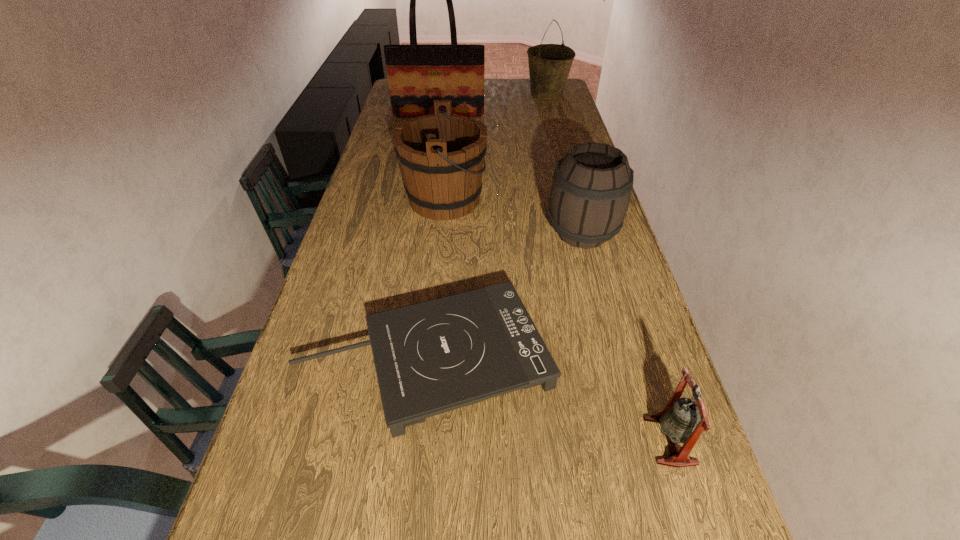
At what (x,y) coordinates should I click in order to perform the action: click on blank region between the leftmost wine bucket and the hotplate. Please return your answer as a coordinate pair (x, y). This screenshot has width=960, height=540. Looking at the image, I should click on (436, 279).

Image resolution: width=960 pixels, height=540 pixels. I want to click on free space between the farthest object and the hotplate, so click(x=487, y=226).

Find the location of a particular element. The height and width of the screenshot is (540, 960). empty space between the fifth tallest object and the tallest object is located at coordinates (554, 278).

The height and width of the screenshot is (540, 960). Find the location of `free spot between the leftmost wine bucket and the farthest wine bucket`. free spot between the leftmost wine bucket and the farthest wine bucket is located at coordinates (495, 146).

Find the location of a particular element. The width and height of the screenshot is (960, 540). object that is the third nearest to the hotplate is located at coordinates (441, 156).

This screenshot has height=540, width=960. What are the coordinates of `object that is the closest to the hotplate` in the screenshot? It's located at (589, 198).

You are a GUI agent. You are given a task and a screenshot of the screen. Output one action in this format:
    pyautogui.click(x=<x>, y=<y>)
    Task: Click on the second closest wine bucket to the second shortest object
    Image resolution: width=960 pixels, height=540 pixels.
    Given the screenshot: What is the action you would take?
    pyautogui.click(x=441, y=156)

This screenshot has height=540, width=960. Identify the location of wine bucket that is the second closest one to the tallest object. (441, 156).

Find the location of a particular element. The height and width of the screenshot is (540, 960). free point that satisfies the following two spatial constraints: 1. on the side of the leftmost wine bucket with the handle for carrying; 2. on the right side of the second shortest object is located at coordinates (420, 441).

Where is `vacant space that satisfies the following two spatial constraints: 1. on the front side of the farthest wine bucket; 2. on the left side of the bell`? This screenshot has height=540, width=960. vacant space that satisfies the following two spatial constraints: 1. on the front side of the farthest wine bucket; 2. on the left side of the bell is located at coordinates (642, 441).